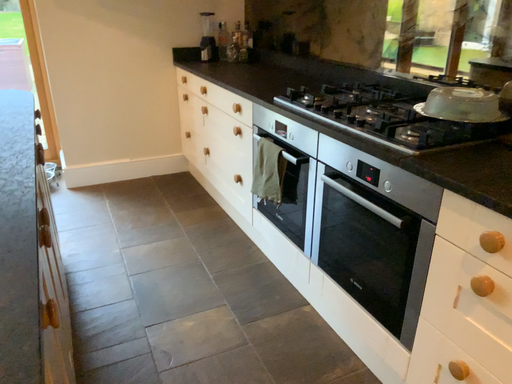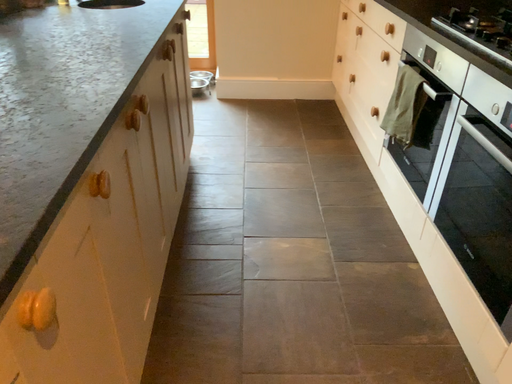
Question: How did the camera likely rotate when shooting the video?

Choices:
 (A) rotated downward
 (B) rotated upward

Answer: (A)